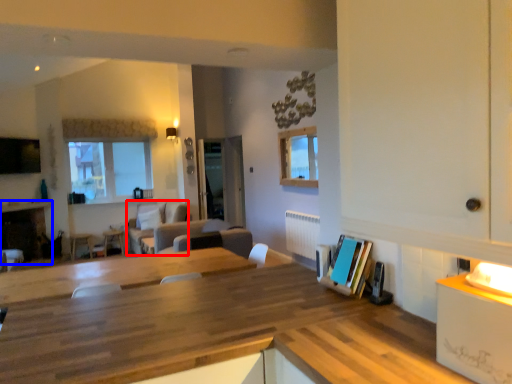
Question: Which object is closer to the camera taking this photo, couch (highlighted by a red box) or fireplace (highlighted by a blue box)?

Choices:
 (A) couch
 (B) fireplace

Answer: (B)